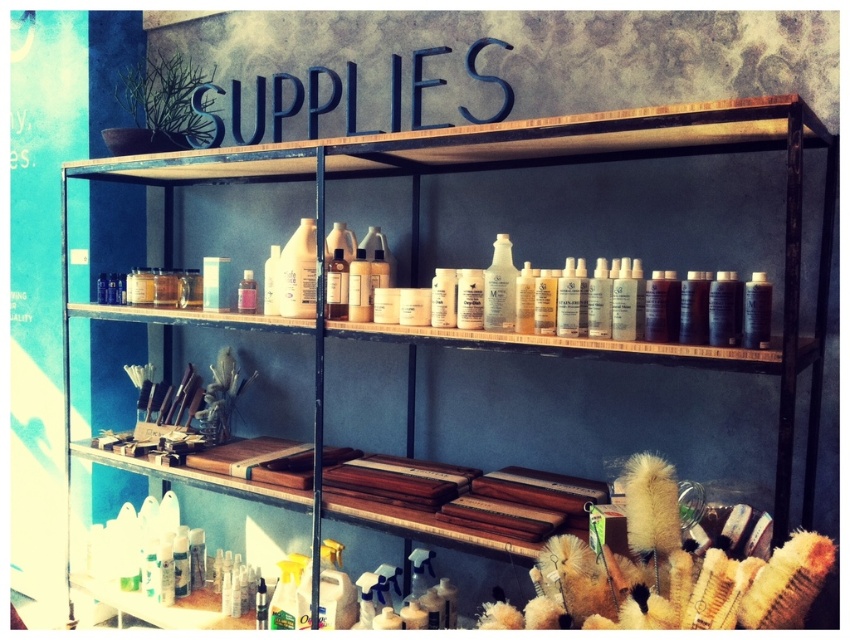
Who is positioned more to the left, translucent plastic bottle at center or pink matte jar at center?

pink matte jar at center is more to the left.

What do you see at coordinates (499, 288) in the screenshot? The height and width of the screenshot is (640, 850). I see `translucent plastic bottle at center` at bounding box center [499, 288].

Who is more forward, (486,326) or (255,292)?

Point (486,326) is more forward.

Locate an element on the screen. The width and height of the screenshot is (850, 640). translucent plastic bottle at center is located at coordinates (499, 288).